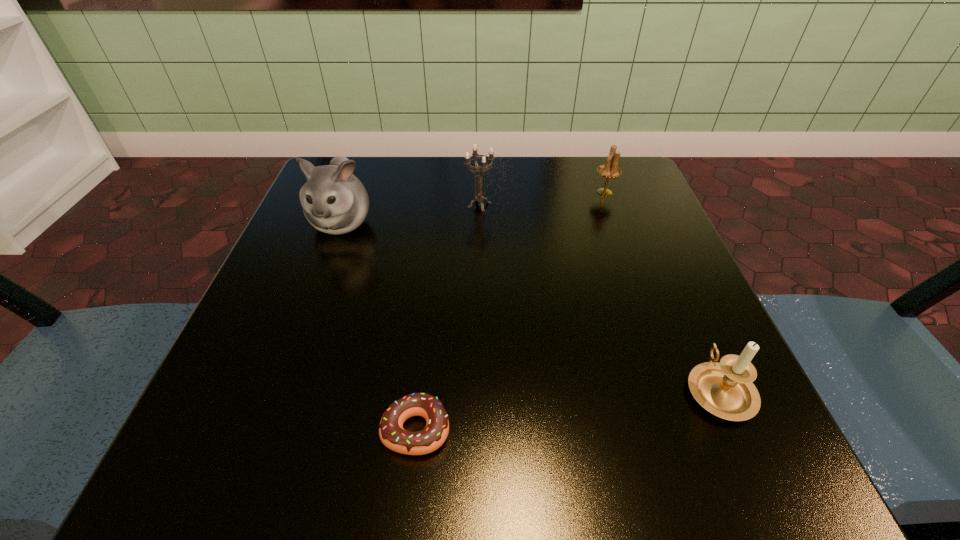
I want to click on the leftmost object, so [x=334, y=201].

Identify the location of the tallest object. (x=334, y=201).

The width and height of the screenshot is (960, 540). Find the location of `the third object from right to left`. the third object from right to left is located at coordinates (479, 197).

You are a GUI agent. You are given a task and a screenshot of the screen. Output one action in this format:
    pyautogui.click(x=<x>, y=<y>)
    Task: Click on the nearest candle holder
    The height and width of the screenshot is (540, 960).
    Given the screenshot: What is the action you would take?
    pyautogui.click(x=725, y=389)

Image resolution: width=960 pixels, height=540 pixels. In order to click on the fourth object from right to left in this screenshot , I will do `click(392, 434)`.

The width and height of the screenshot is (960, 540). I want to click on doughnut, so click(392, 434).

Where is `vacant space situated 0.310m on the face of the hamster`? The height and width of the screenshot is (540, 960). vacant space situated 0.310m on the face of the hamster is located at coordinates (276, 400).

Locate an element on the screen. free region located 0.340m on the right of the leftmost candle holder is located at coordinates pyautogui.click(x=657, y=205).

This screenshot has width=960, height=540. What are the coordinates of `vacant region located 0.120m with a handle on the side of the nearest candle holder` in the screenshot? It's located at (678, 298).

Image resolution: width=960 pixels, height=540 pixels. Identify the location of free space located 0.300m with a handle on the side of the nearest candle holder. click(648, 230).